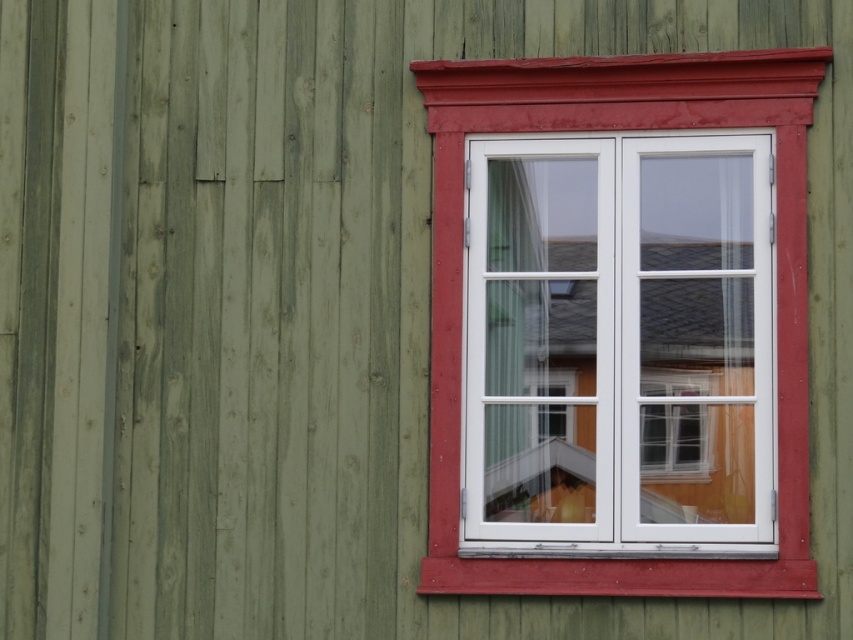
Does matte white window frame at center have a greater width compared to white sheer curtain at center?

Yes.

Is matte white window frame at center in front of white sheer curtain at center?

Yes, it is in front of white sheer curtain at center.

Where is `matte white window frame at center`? This screenshot has height=640, width=853. matte white window frame at center is located at coordinates (776, 285).